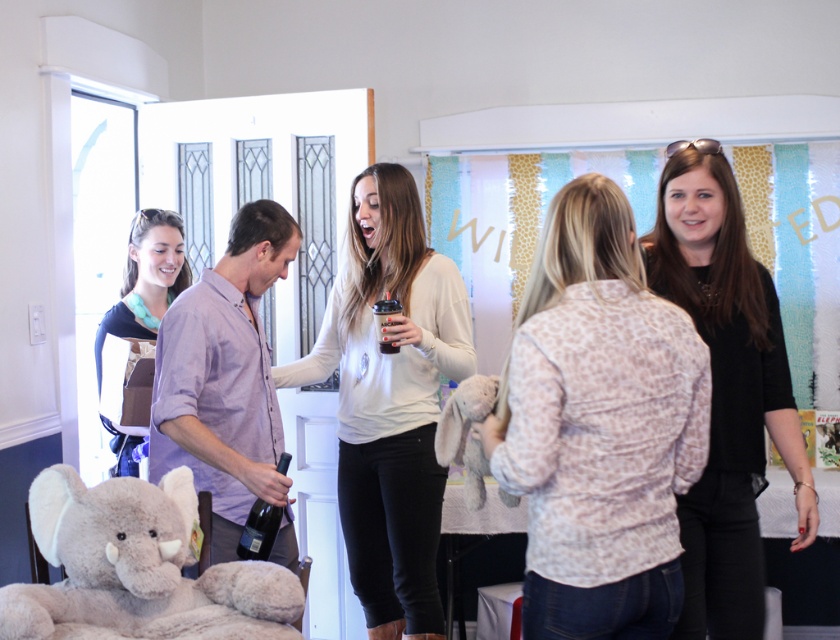
Question: Which point appears closest to the camera in this image?

Choices:
 (A) (655, 358)
 (B) (302, 595)
 (C) (744, 540)

Answer: (A)

Question: Does black matte shirt at right appear on the left side of matte black shirt at left?

Choices:
 (A) yes
 (B) no

Answer: (B)

Question: Which point is closer to the camera taking this photo?

Choices:
 (A) (228, 582)
 (B) (368, 195)

Answer: (A)

Question: Does black matte shirt at right appear on the right side of matte black shirt at left?

Choices:
 (A) yes
 (B) no

Answer: (A)

Question: Which point is closer to the camera taking this photo?

Choices:
 (A) (744, 492)
 (B) (685, 337)
 (C) (192, 592)

Answer: (C)

Question: Can you confirm if white matte sweater at center is bigger than matte black shirt at left?

Choices:
 (A) yes
 (B) no

Answer: (A)